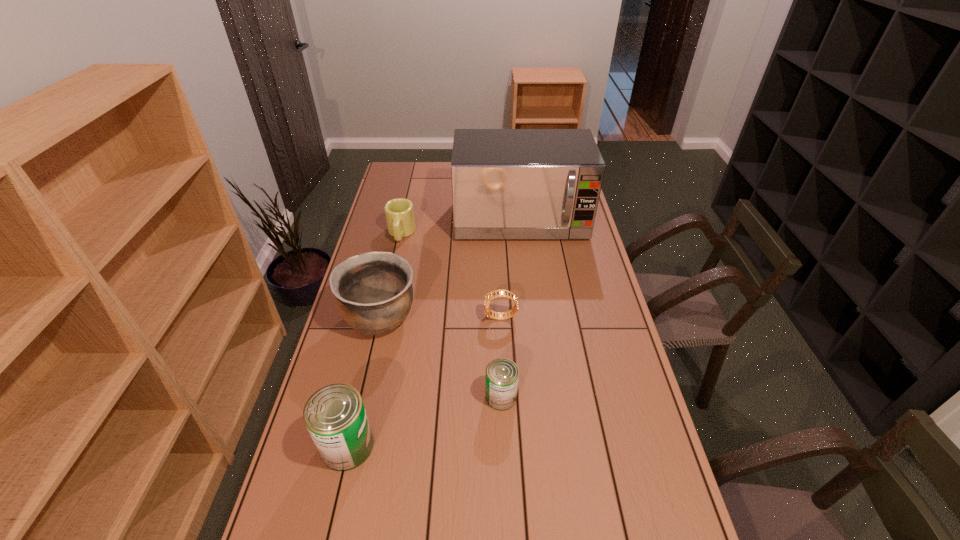
The image size is (960, 540). What are the coordinates of `vacant space located on the face of the watch` in the screenshot? It's located at (419, 318).

Where is `vacant region located on the face of the watch`? vacant region located on the face of the watch is located at coordinates (x=377, y=318).

Locate an element on the screen. The image size is (960, 540). free space located on the face of the watch is located at coordinates (413, 318).

Where is `vacant space located 0.350m with the door open on the tallest object`? vacant space located 0.350m with the door open on the tallest object is located at coordinates (531, 309).

You are a GUI agent. You are given a task and a screenshot of the screen. Output one action in this format:
    pyautogui.click(x=<x>, y=<y>)
    Task: Click on the vacant area located with the handle on the side of the mug
    This screenshot has width=960, height=540.
    Given the screenshot: What is the action you would take?
    pyautogui.click(x=383, y=314)

You are a GUI agent. You are given a task and a screenshot of the screen. Output one action in this format:
    pyautogui.click(x=<x>, y=<y>)
    Task: Click on the free spot located on the right of the pottery
    The width and height of the screenshot is (960, 540).
    Given the screenshot: What is the action you would take?
    pyautogui.click(x=467, y=318)

You are a GUI agent. You are given a task and a screenshot of the screen. Output one action in this format:
    pyautogui.click(x=<x>, y=<y>)
    Task: Click on the can that is at the left edge
    
    Given the screenshot: What is the action you would take?
    pyautogui.click(x=335, y=416)

Locate an element on the screen. The height and width of the screenshot is (540, 960). mug that is positioned at the left edge is located at coordinates (399, 212).

Find the location of `pottery located in the left edge section of the desktop`. pottery located in the left edge section of the desktop is located at coordinates pos(374,293).

The height and width of the screenshot is (540, 960). In order to click on object that is at the right edge in this screenshot , I will do `click(506, 183)`.